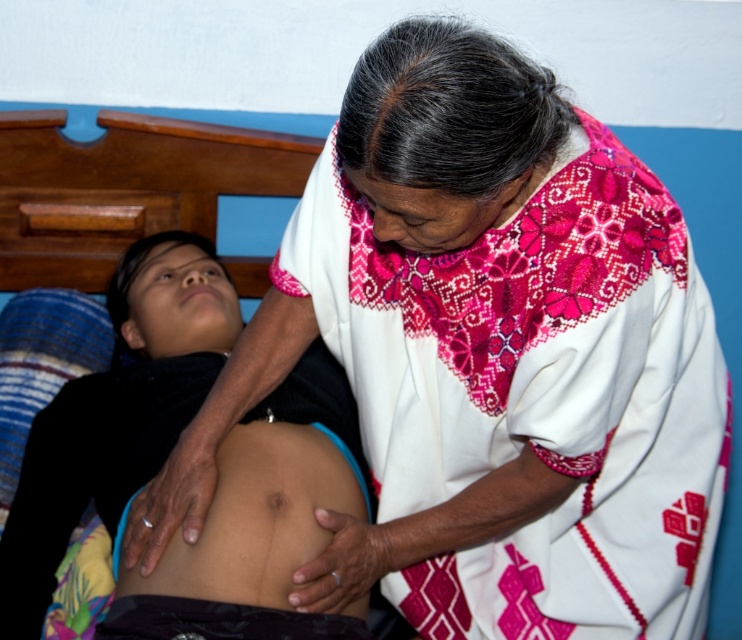
From the picture: Which is above, skinny white skin at center or smooth skin at center?

skinny white skin at center is above.

Who is shorter, skinny white skin at center or smooth skin at center?

Standing shorter between the two is smooth skin at center.

Is point (266, 576) positioned after point (295, 544)?

No.

Identify the location of skinny white skin at center. (165, 456).